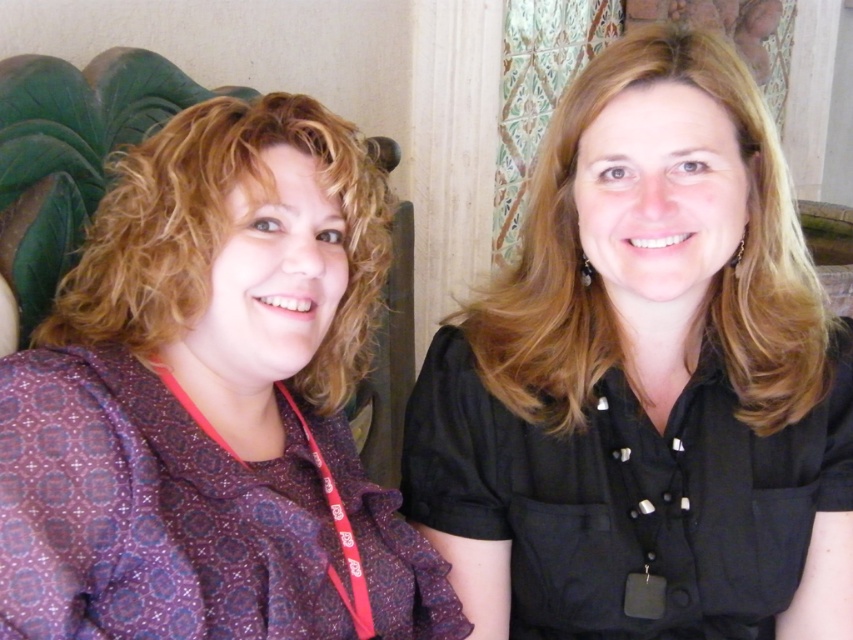
Does point (480, 586) lie in front of point (326, 609)?

No, it is not.

Is black matte shirt at upper right to the left of purple printed blouse at left from the viewer's perspective?

Incorrect, black matte shirt at upper right is not on the left side of purple printed blouse at left.

The image size is (853, 640). In order to click on black matte shirt at upper right in this screenshot , I will do `click(645, 380)`.